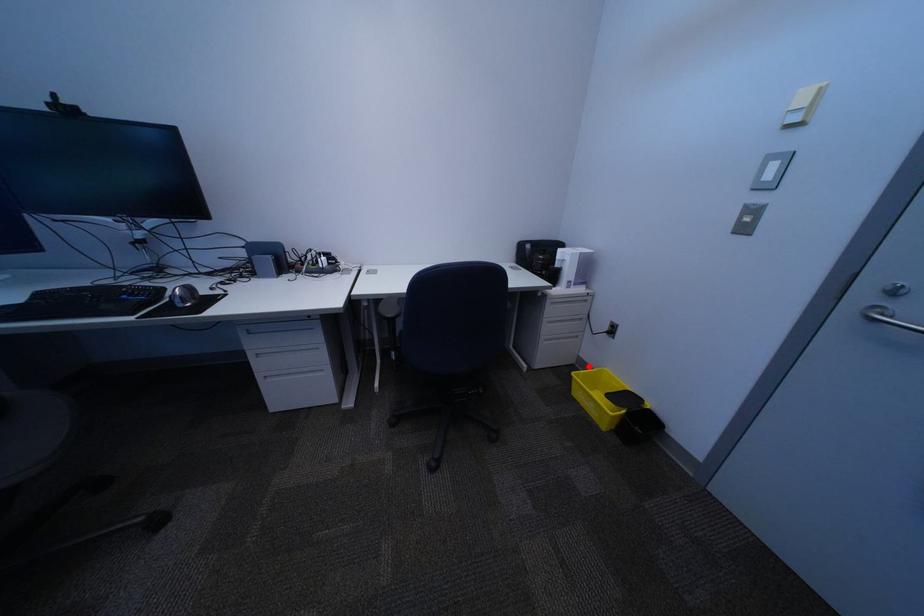
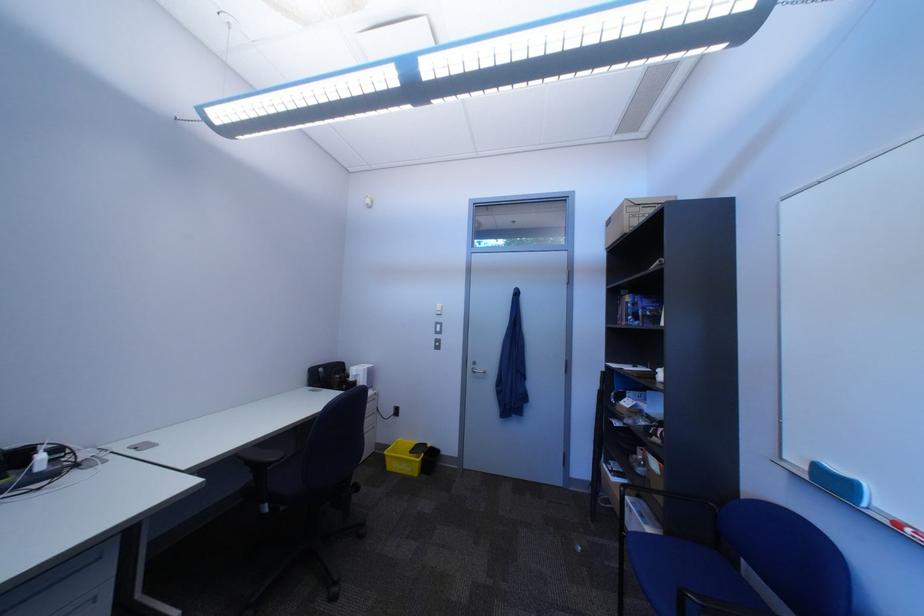
In the second image, find the point that corresponds to the highlighted location in the first image.

(388, 454)